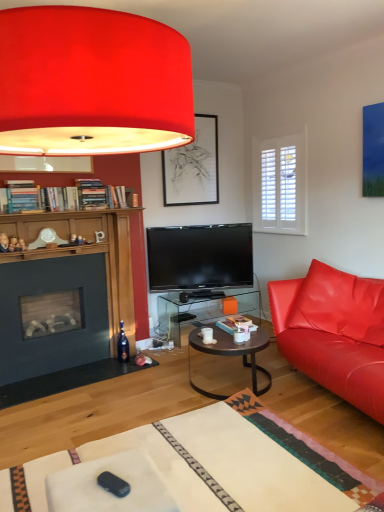
What do you see at coordinates (193, 167) in the screenshot? I see `matte black picture frame at upper center` at bounding box center [193, 167].

Describe the element at coordinates (232, 354) in the screenshot. I see `metallic dark brown coffee table at center` at that location.

You are a GUI agent. You are given a task and a screenshot of the screen. Output one action in this format:
    pyautogui.click(x=<x>, y=<y>)
    Task: Click on the matte black picture frame at upper center
    
    Given the screenshot: What is the action you would take?
    pyautogui.click(x=193, y=167)

Which object is further away from the camera, black plastic remote control at lower center or matte black picture frame at upper center?

matte black picture frame at upper center is behind.

Image resolution: width=384 pixels, height=512 pixels. Find the location of `remote control in front of the matte black picture frame at upper center`. remote control in front of the matte black picture frame at upper center is located at coordinates (113, 484).

From the picture: Considering the relative sizes of black plastic remote control at lower center and matte black picture frame at upper center in the image provided, is black plastic remote control at lower center wider than matte black picture frame at upper center?

Indeed, black plastic remote control at lower center has a greater width compared to matte black picture frame at upper center.

Between black plastic remote control at lower center and matte black picture frame at upper center, which one has less height?

black plastic remote control at lower center.

In terms of height, does white glossy coffee cup at center look taller or shorter compared to matte black picture frame at upper center?

In the image, white glossy coffee cup at center appears to be shorter than matte black picture frame at upper center.

Is white glossy coffee cup at center smaller than matte black picture frame at upper center?

Yes.

Is white glossy coffee cup at center facing away from matte black picture frame at upper center?

That's not correct — white glossy coffee cup at center is not looking away from matte black picture frame at upper center.

How many degrees apart are the facing directions of white glossy coffee cup at center and matte black picture frame at upper center?

The angle between the facing direction of white glossy coffee cup at center and the facing direction of matte black picture frame at upper center is 60.8 degrees.

Is matte black picture frame at upper center looking in the opposite direction of translucent glass table at center?

No, translucent glass table at center is not at the back of matte black picture frame at upper center.

Considering the positions of objects matte black picture frame at upper center and translucent glass table at center in the image provided, who is more to the right, matte black picture frame at upper center or translucent glass table at center?

Positioned to the right is translucent glass table at center.

Where is `desk below the matte black picture frame at upper center (from the image's perspective)`? desk below the matte black picture frame at upper center (from the image's perspective) is located at coordinates (x=187, y=314).

From the image's perspective, is matte red lampshade at upper center on black plastic remote control at lower center?

Yes.

Is matte red lampshade at upper center outside of black plastic remote control at lower center?

matte red lampshade at upper center lies outside black plastic remote control at lower center's area.

Is matte red lampshade at upper center turned away from black plastic remote control at lower center?

No.

Where is `lamp in front of the black plastic remote control at lower center`? lamp in front of the black plastic remote control at lower center is located at coordinates (92, 83).

Would you say metallic dark brown coffee table at center is a long distance from matte red lampshade at upper center?

Yes, metallic dark brown coffee table at center and matte red lampshade at upper center are located far from each other.

The image size is (384, 512). Identify the location of lamp in front of the metallic dark brown coffee table at center. (92, 83).

Based on their sizes in the image, would you say metallic dark brown coffee table at center is bigger or smaller than matte red lampshade at upper center?

Considering their sizes, metallic dark brown coffee table at center takes up less space than matte red lampshade at upper center.

Which is closer to the camera, [244,332] or [253,367]?

Point [244,332]

From the image's perspective, does white glossy coffee cup at center appear lower than metallic dark brown coffee table at center?

Actually, white glossy coffee cup at center appears above metallic dark brown coffee table at center in the image.

Is white glossy coffee cup at center inside or outside of metallic dark brown coffee table at center?

white glossy coffee cup at center lies outside metallic dark brown coffee table at center.

Who is bigger, white glossy coffee cup at center or metallic dark brown coffee table at center?

Bigger between the two is metallic dark brown coffee table at center.

Where is `coffee table in front of the translucent glass table at center`? The width and height of the screenshot is (384, 512). coffee table in front of the translucent glass table at center is located at coordinates (232, 354).

Considering the relative sizes of metallic dark brown coffee table at center and translucent glass table at center in the image provided, is metallic dark brown coffee table at center taller than translucent glass table at center?

In fact, metallic dark brown coffee table at center may be shorter than translucent glass table at center.

Based on their sizes in the image, would you say metallic dark brown coffee table at center is bigger or smaller than translucent glass table at center?

Considering their sizes, metallic dark brown coffee table at center takes up less space than translucent glass table at center.

Between metallic dark brown coffee table at center and translucent glass table at center, which one has smaller width?

With smaller width is translucent glass table at center.

Locate an element on the screen. picture frame behind the black plastic remote control at lower center is located at coordinates (193, 167).

Where is `picture frame on the left of white glossy coffee cup at center`? picture frame on the left of white glossy coffee cup at center is located at coordinates (193, 167).

Estimate the real-world distances between objects in this image. Which object is closer to matte black picture frame at upper center, matte leather couch at right or matte red lampshade at upper center?

matte leather couch at right is closer to matte black picture frame at upper center.

Based on their spatial positions, is translucent glass table at center or matte leather couch at right further from black plastic remote control at lower center?

Among the two, translucent glass table at center is located further to black plastic remote control at lower center.

Looking at the image, which one is located further to metallic dark brown coffee table at center, matte black picture frame at upper center or matte red lampshade at upper center?

matte black picture frame at upper center is further to metallic dark brown coffee table at center.

From the picture: Considering their positions, is translucent glass table at center positioned closer to matte red lampshade at upper center than matte black picture frame at upper center?

matte black picture frame at upper center is closer to matte red lampshade at upper center.

Based on their spatial positions, is translucent glass table at center or white glossy coffee cup at center further from black plastic remote control at lower center?

translucent glass table at center.

When comparing their distances from translucent glass table at center, does matte leather couch at right or metallic dark brown coffee table at center seem further?

Among the two, matte leather couch at right is located further to translucent glass table at center.

Considering their positions, is metallic dark brown coffee table at center positioned closer to black plastic remote control at lower center than matte red lampshade at upper center?

matte red lampshade at upper center lies closer to black plastic remote control at lower center than the other object.

Looking at the image, which one is located further to translucent glass table at center, matte leather couch at right or white glossy coffee cup at center?

Based on the image, matte leather couch at right appears to be further to translucent glass table at center.

I want to click on coffee table between matte red lampshade at upper center and matte black picture frame at upper center along the z-axis, so click(x=232, y=354).

Identify the location of coffee cup positioned between matte red lampshade at upper center and matte black picture frame at upper center from near to far. (241, 335).

Locate an element on the screen. studio couch located between matte red lampshade at upper center and white glossy coffee cup at center in the depth direction is located at coordinates (334, 333).

What are the coordinates of `studio couch located between matte red lampshade at upper center and translucent glass table at center in the depth direction` in the screenshot? It's located at (334, 333).